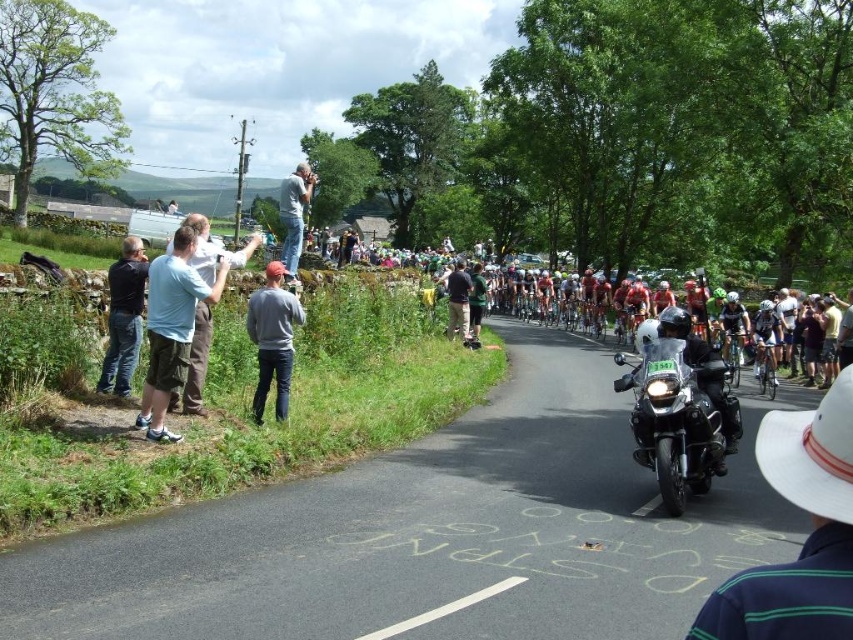
You are a cyclist participating in the race and you want to know if you can safely pass between the two points marked as point (x=163, y=337) and another point without hitting any obstacles. The minimum safe distance for passing is 25 feet. Can you safely pass?

The distance between the two points is 27.02 feet, which is greater than the minimum safe distance of 25 feet. Therefore, you can safely pass between them.

You are a cyclist participating in the race and currently positioned at point (x=299, y=234). You need to reach the finish line ahead. There is a cyclist ahead at point (x=148, y=321). If you decide to overtake them by moving to the right side of the road, will you be able to pass them before the road curves to the right?

Point (x=148, y=321) is in front of point (x=299, y=234), so overtaking to the right side before the road curves to the right is possible as the cyclist ahead is positioned further along the route.

You are a photographer positioned at the starting line of the cycling race. You want to capture a photo that includes both the shiny black motorcycle at center and the light blue shirt at upper center. Which object should you adjust your camera to focus on first to ensure both are in the frame?

You should focus on the light blue shirt at upper center first because the shiny black motorcycle at center is to the right of it, so adjusting from the left side ensures both are included.